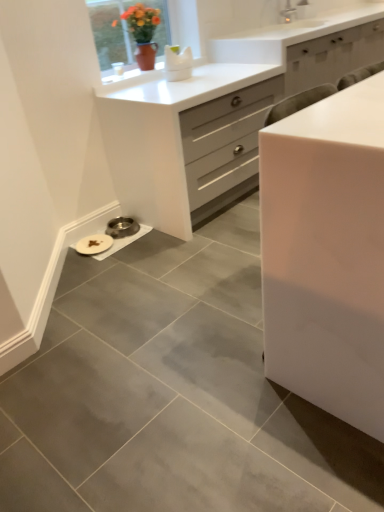
Question: Considering the relative sizes of matte ceramic vase at upper center and white glossy cabinet at center, marked as the first chest of drawers in a front-to-back arrangement, in the image provided, is matte ceramic vase at upper center thinner than white glossy cabinet at center, marked as the first chest of drawers in a front-to-back arrangement,?

Choices:
 (A) yes
 (B) no

Answer: (B)

Question: From the image's perspective, is matte ceramic vase at upper center over white glossy cabinet at center, which is counted as the 2th chest of drawers, starting from the back?

Choices:
 (A) no
 (B) yes

Answer: (B)

Question: Is matte ceramic vase at upper center bigger than white glossy cabinet at center, marked as the first chest of drawers in a front-to-back arrangement?

Choices:
 (A) yes
 (B) no

Answer: (B)

Question: Is matte ceramic vase at upper center to the left of white glossy cabinet at center, which is counted as the 2th chest of drawers, starting from the back, from the viewer's perspective?

Choices:
 (A) no
 (B) yes

Answer: (B)

Question: From a real-world perspective, does matte ceramic vase at upper center sit lower than white glossy cabinet at center, marked as the first chest of drawers in a front-to-back arrangement?

Choices:
 (A) yes
 (B) no

Answer: (B)

Question: Based on their positions, is white glossy chest of drawers at center, placed as the second chest of drawers when sorted from front to back, located to the left or right of white glossy cabinet at center, marked as the first chest of drawers in a front-to-back arrangement?

Choices:
 (A) right
 (B) left

Answer: (B)

Question: Considering the positions of white glossy chest of drawers at center, the first chest of drawers when ordered from back to front, and white glossy cabinet at center, which is counted as the 2th chest of drawers, starting from the back, in the image, is white glossy chest of drawers at center, the first chest of drawers when ordered from back to front, wider or thinner than white glossy cabinet at center, which is counted as the 2th chest of drawers, starting from the back,?

Choices:
 (A) wide
 (B) thin

Answer: (A)

Question: Based on their sizes in the image, would you say white glossy chest of drawers at center, the first chest of drawers when ordered from back to front, is bigger or smaller than white glossy cabinet at center, marked as the first chest of drawers in a front-to-back arrangement?

Choices:
 (A) big
 (B) small

Answer: (A)

Question: In the image, is white glossy chest of drawers at center, the first chest of drawers when ordered from back to front, positioned in front of or behind white glossy cabinet at center, which is counted as the 2th chest of drawers, starting from the back?

Choices:
 (A) behind
 (B) front

Answer: (A)

Question: Considering the positions of matte ceramic vase at upper center and white glossy chest of drawers at center, the first chest of drawers when ordered from back to front, in the image, is matte ceramic vase at upper center taller or shorter than white glossy chest of drawers at center, the first chest of drawers when ordered from back to front,?

Choices:
 (A) tall
 (B) short

Answer: (B)

Question: Is matte ceramic vase at upper center inside or outside of white glossy chest of drawers at center, the first chest of drawers when ordered from back to front?

Choices:
 (A) inside
 (B) outside

Answer: (B)

Question: Considering their positions, is matte ceramic vase at upper center located in front of or behind white glossy chest of drawers at center, placed as the second chest of drawers when sorted from front to back?

Choices:
 (A) behind
 (B) front

Answer: (A)

Question: Considering the positions of matte ceramic vase at upper center and white glossy chest of drawers at center, the first chest of drawers when ordered from back to front, in the image, is matte ceramic vase at upper center wider or thinner than white glossy chest of drawers at center, the first chest of drawers when ordered from back to front,?

Choices:
 (A) thin
 (B) wide

Answer: (A)

Question: Considering the relative positions of white glossy cabinet at center, marked as the first chest of drawers in a front-to-back arrangement, and white glossy chest of drawers at center, the first chest of drawers when ordered from back to front, in the image provided, is white glossy cabinet at center, marked as the first chest of drawers in a front-to-back arrangement, to the left or to the right of white glossy chest of drawers at center, the first chest of drawers when ordered from back to front,?

Choices:
 (A) right
 (B) left

Answer: (A)

Question: Looking at the image, does white glossy cabinet at center, marked as the first chest of drawers in a front-to-back arrangement, seem bigger or smaller compared to white glossy chest of drawers at center, placed as the second chest of drawers when sorted from front to back?

Choices:
 (A) small
 (B) big

Answer: (A)